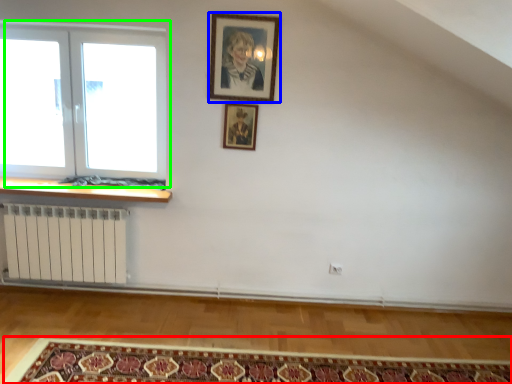
Question: Considering the real-world distances, which object is closest to mat (highlighted by a red box)? picture frame (highlighted by a blue box) or window (highlighted by a green box).

Choices:
 (A) picture frame
 (B) window

Answer: (B)